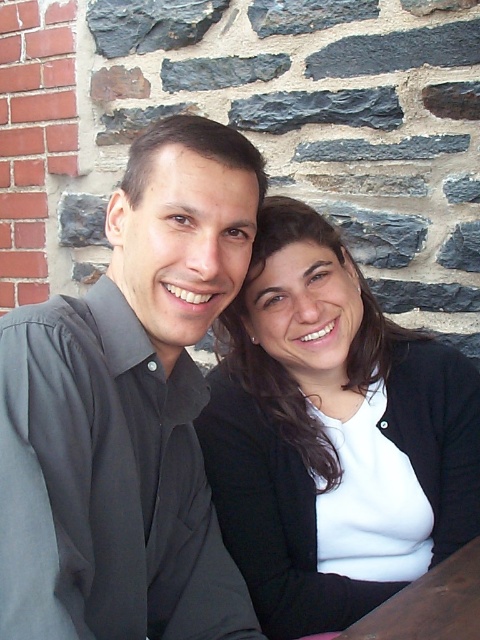
You are standing at the point labeled as point (187, 294) and want to take a photo of the scene. The camera you are using has a focal length of 50mm and a sensor size of 36mm. What is the minimum distance you need to move backward to ensure the entire scene fits within the camera frame?

The point labeled point (187, 294) is 37.68 inches away from the viewer. To calculate the minimum distance to move backward, first convert the focal length to inches. 50mm is approximately 1.9685 inches. The sensor size of 36mm converts to about 1.417 inches. Using the formula for field of view, FOV in inches would be 2 times the sensor size divided by the focal length. So, FOV is 2 times 1.417 divided by 1.9685, which equals roughly 1.43 inches. Since the current distance is 37.68 inches, and the FOV is